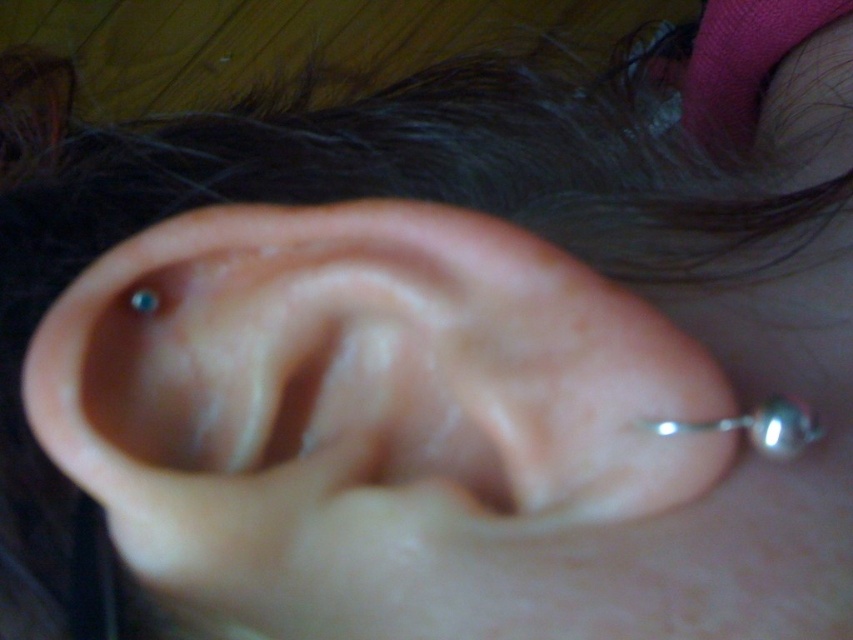
Question: Which of the following is the farthest from the observer?

Choices:
 (A) silver metallic earring at upper left
 (B) silver metallic ball at lower right
 (C) blue metallic earring at upper left

Answer: (C)

Question: Can you confirm if pink flesh-colored ear at center is positioned below silver metallic ball at lower right?

Choices:
 (A) no
 (B) yes

Answer: (A)

Question: Can you confirm if silver metallic ball at lower right is positioned to the left of blue metallic earring at upper left?

Choices:
 (A) no
 (B) yes

Answer: (A)

Question: Which of the following is the farthest from the observer?

Choices:
 (A) (192, 490)
 (B) (136, 298)
 (C) (155, 300)
 (D) (764, 436)

Answer: (C)

Question: Among these points, which one is farthest from the camera?

Choices:
 (A) (142, 307)
 (B) (151, 300)
 (C) (352, 269)
 (D) (759, 408)

Answer: (B)

Question: Does pink flesh-colored ear at center come in front of blue metallic earring at upper left?

Choices:
 (A) yes
 (B) no

Answer: (A)